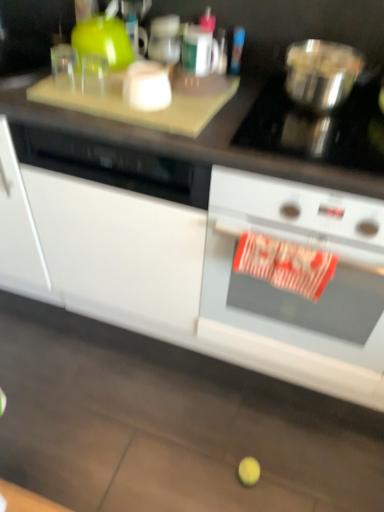
Question: Should I look upward or downward to see white matte cabinet at lower center?

Choices:
 (A) down
 (B) up

Answer: (B)

Question: Considering the relative sizes of white glossy oven at right and metallic silver bowl at upper right in the image provided, is white glossy oven at right thinner than metallic silver bowl at upper right?

Choices:
 (A) no
 (B) yes

Answer: (A)

Question: From a real-world perspective, is white glossy oven at right physically above metallic silver bowl at upper right?

Choices:
 (A) yes
 (B) no

Answer: (B)

Question: Is the depth of white glossy oven at right greater than that of metallic silver bowl at upper right?

Choices:
 (A) no
 (B) yes

Answer: (A)

Question: Considering the relative positions of white glossy oven at right and metallic silver bowl at upper right in the image provided, is white glossy oven at right to the right of metallic silver bowl at upper right from the viewer's perspective?

Choices:
 (A) no
 (B) yes

Answer: (B)

Question: Considering the relative sizes of white glossy oven at right and metallic silver bowl at upper right in the image provided, is white glossy oven at right shorter than metallic silver bowl at upper right?

Choices:
 (A) no
 (B) yes

Answer: (A)

Question: Considering the relative positions of white glossy oven at right and metallic silver bowl at upper right in the image provided, is white glossy oven at right to the left of metallic silver bowl at upper right from the viewer's perspective?

Choices:
 (A) no
 (B) yes

Answer: (A)

Question: Would you say white matte cabinet at lower center contains white glossy oven at right?

Choices:
 (A) no
 (B) yes

Answer: (B)

Question: Is white matte cabinet at lower center thinner than white glossy oven at right?

Choices:
 (A) no
 (B) yes

Answer: (A)

Question: From the image's perspective, is white matte cabinet at lower center on top of white glossy oven at right?

Choices:
 (A) yes
 (B) no

Answer: (A)

Question: From a real-world perspective, is white matte cabinet at lower center over white glossy oven at right?

Choices:
 (A) yes
 (B) no

Answer: (A)

Question: Is the depth of white matte cabinet at lower center greater than that of white glossy oven at right?

Choices:
 (A) no
 (B) yes

Answer: (A)

Question: Is white matte cabinet at lower center placed right next to white glossy oven at right?

Choices:
 (A) yes
 (B) no

Answer: (B)

Question: Does metallic silver bowl at upper right have a greater width compared to white matte cabinet at lower center?

Choices:
 (A) yes
 (B) no

Answer: (B)